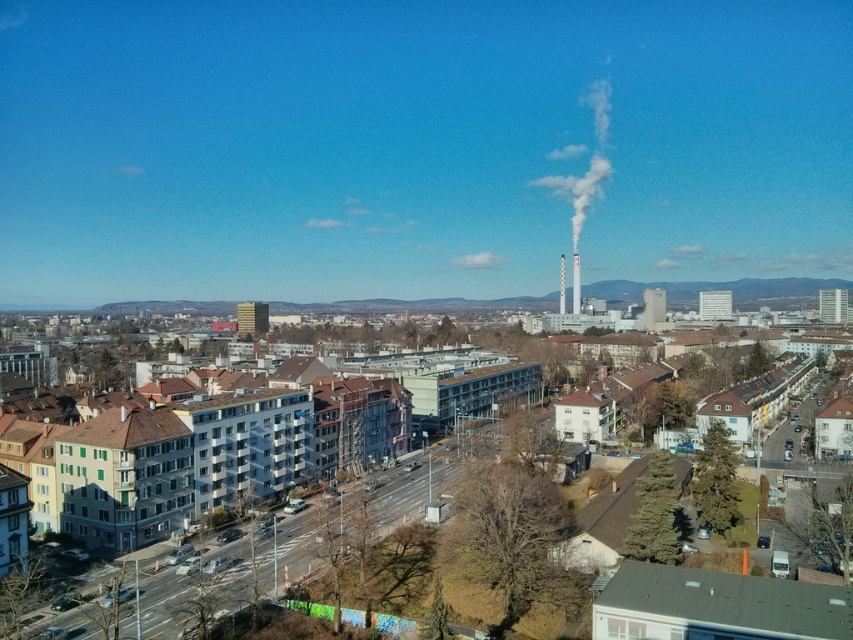
Question: Among these points, which one is farthest from the camera?

Choices:
 (A) (581, 99)
 (B) (576, 268)

Answer: (A)

Question: Can you confirm if white smoke at upper center is thinner than smooth gray chimney at center-right?

Choices:
 (A) no
 (B) yes

Answer: (A)

Question: Does white smoke at upper center appear over smooth gray chimney at center-right?

Choices:
 (A) no
 (B) yes

Answer: (B)

Question: Which object is closer to the camera taking this photo?

Choices:
 (A) white smoke at upper center
 (B) smooth gray chimney at center-right

Answer: (B)

Question: Can you confirm if white smoke at upper center is positioned above smooth gray chimney at center-right?

Choices:
 (A) no
 (B) yes

Answer: (B)